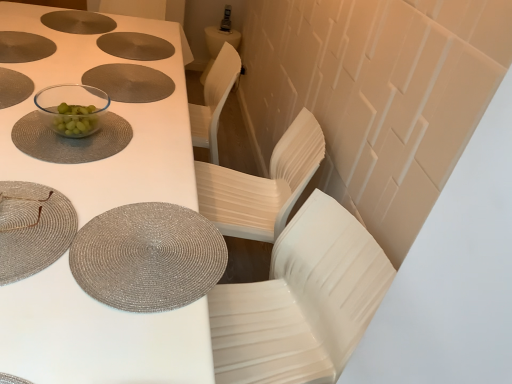
Find the location of a particular element. The image size is (512, 384). empty space that is in between silver woven placemat at lower left, acting as the fourth tableware starting from the top, and matte silver placemat at center is located at coordinates (82, 145).